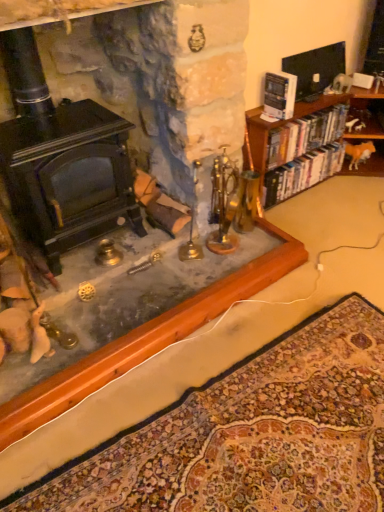
Question: From a real-world perspective, is carpeted mat at lower center located beneath hardcover books at right, the second book viewed from the back?

Choices:
 (A) no
 (B) yes

Answer: (B)

Question: Does carpeted mat at lower center lie in front of hardcover books at right, the second book viewed from the back?

Choices:
 (A) no
 (B) yes

Answer: (B)

Question: Is carpeted mat at lower center positioned beyond the bounds of hardcover books at right, marked as the second book in a front-to-back arrangement?

Choices:
 (A) no
 (B) yes

Answer: (B)

Question: Can you confirm if carpeted mat at lower center is smaller than hardcover books at right, the second book viewed from the back?

Choices:
 (A) yes
 (B) no

Answer: (B)

Question: Is carpeted mat at lower center thinner than hardcover books at right, the second book viewed from the back?

Choices:
 (A) no
 (B) yes

Answer: (A)

Question: From a real-world perspective, is carpeted mat at lower center positioned above or below black matte fireplace at left?

Choices:
 (A) below
 (B) above

Answer: (A)

Question: Would you say carpeted mat at lower center is to the left or to the right of black matte fireplace at left in the picture?

Choices:
 (A) left
 (B) right

Answer: (B)

Question: Looking at their shapes, would you say carpeted mat at lower center is wider or thinner than black matte fireplace at left?

Choices:
 (A) wide
 (B) thin

Answer: (A)

Question: From the image's perspective, is carpeted mat at lower center positioned above or below black matte fireplace at left?

Choices:
 (A) below
 (B) above

Answer: (A)

Question: Is carpeted mat at lower center in front of or behind white paper book at upper right, which is the first book from front to back, in the image?

Choices:
 (A) front
 (B) behind

Answer: (A)

Question: From a real-world perspective, relative to white paper book at upper right, the third book when ordered from back to front, is carpeted mat at lower center vertically above or below?

Choices:
 (A) above
 (B) below

Answer: (B)

Question: Considering the relative positions of carpeted mat at lower center and white paper book at upper right, the third book when ordered from back to front, in the image provided, is carpeted mat at lower center to the left or to the right of white paper book at upper right, the third book when ordered from back to front,?

Choices:
 (A) left
 (B) right

Answer: (A)

Question: From the image's perspective, is carpeted mat at lower center above or below white paper book at upper right, the third book when ordered from back to front?

Choices:
 (A) below
 (B) above

Answer: (A)

Question: Considering the positions of hardcover books at right, which ranks as the 3th book in front-to-back order, and black matte fireplace at left in the image, is hardcover books at right, which ranks as the 3th book in front-to-back order, bigger or smaller than black matte fireplace at left?

Choices:
 (A) big
 (B) small

Answer: (B)

Question: Is hardcover books at right, the first book when ordered from back to front, situated inside black matte fireplace at left or outside?

Choices:
 (A) outside
 (B) inside

Answer: (A)